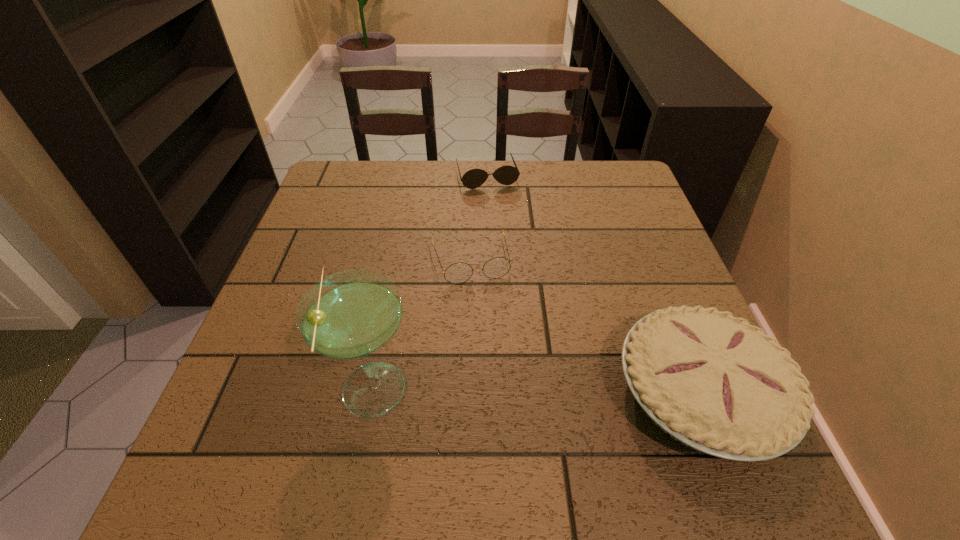
The image size is (960, 540). In order to click on vacant space on the desktop that is between the martini and the pie and is positioned on the temples of the second farthest object in this screenshot , I will do `click(505, 390)`.

The image size is (960, 540). Find the location of `free spot on the desktop that is between the tallest object and the pie and is positioned on the front-facing side of the sunglasses`. free spot on the desktop that is between the tallest object and the pie and is positioned on the front-facing side of the sunglasses is located at coordinates (551, 391).